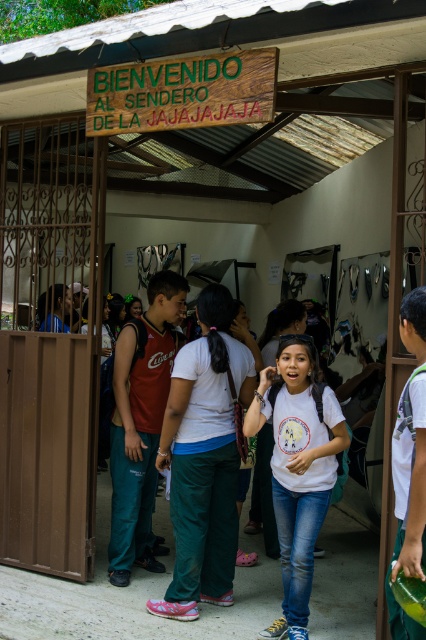
Based on the photo, you are standing at the entrance of the BIENVENIDO AL SENDERO DE LA JAJAJAJAJA trail and see a person wearing a white matte shirt at center. If you want to approach them, which direction should you move relative to your current position?

The white matte shirt at center is located at point 0.733 on the x axis and 0.700 on the y axis, so you should move towards the center of the entrance area to reach them.

You are a photographer positioned outside the entrance, and you want to capture both the white matte shirt at center and the matte red tank top at center in a single photo. Which person should you focus on first to ensure both are in frame?

You should focus on the white matte shirt at center first because it is shorter than the matte red tank top at center, allowing you to adjust the camera angle to include both.

You are standing at the entrance of the metal gate and see two people wearing a white matte shirt at center and a matte red tank top at center. Which person is closer to you?

The white matte shirt at center is closer to the viewer than the matte red tank top at center, so the person wearing the white matte shirt at center is closer to you.